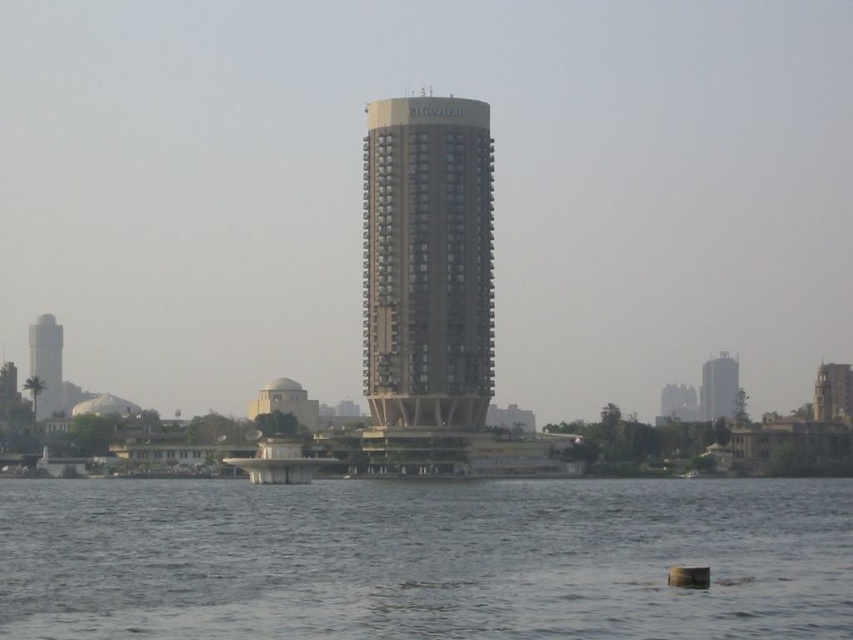
Where is `matte white tower at left`? matte white tower at left is located at coordinates (45, 364).

Locate an element on the screen. This screenshot has height=640, width=853. matte white tower at left is located at coordinates (45, 364).

Can you confirm if beige glass tower at center is thinner than beige concrete tower at center?

Yes.

Does beige glass tower at center have a smaller size compared to beige concrete tower at center?

Indeed, beige glass tower at center has a smaller size compared to beige concrete tower at center.

Identify the location of beige glass tower at center. The image size is (853, 640). (718, 387).

Between gold metallic tower at center and matte white tower at left, which one is positioned lower?

matte white tower at left is lower down.

Does gold metallic tower at center appear on the left side of matte white tower at left?

In fact, gold metallic tower at center is to the right of matte white tower at left.

Describe the element at coordinates (427, 262) in the screenshot. Image resolution: width=853 pixels, height=640 pixels. I see `gold metallic tower at center` at that location.

Where is `gold metallic tower at center`? This screenshot has height=640, width=853. gold metallic tower at center is located at coordinates (427, 262).